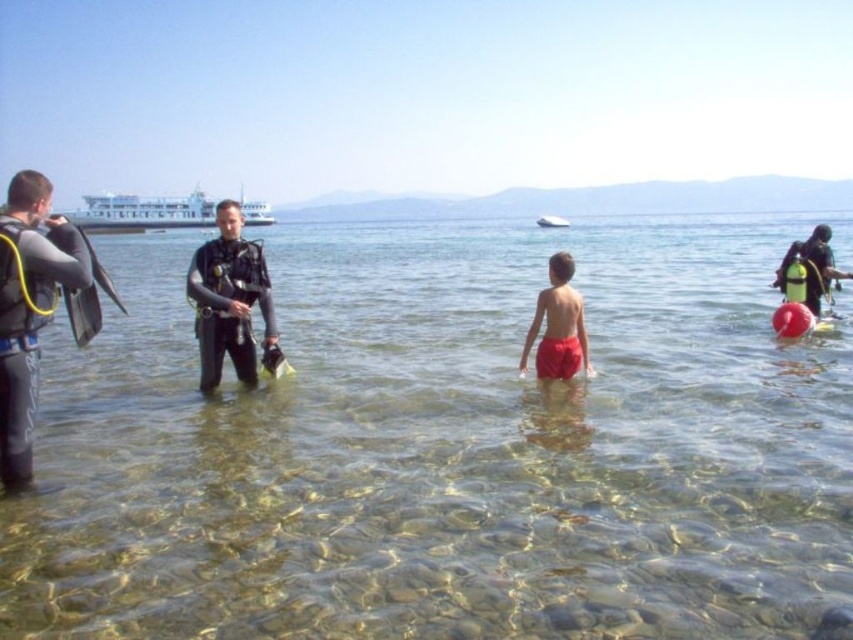
You are a photographer positioned on the beach and want to capture both the black matte scuba gear at center and the white matte ferry at upper left in the same frame. Which object should you focus on first to ensure both are in focus?

You should focus on the black matte scuba gear at center first because it is closer to you than the white matte ferry at upper left, so focusing on the closer object will help keep both in focus.

What object is located at the coordinates point (229, 300) in the image?

The point (229, 300) corresponds to the black matte scuba gear at center.